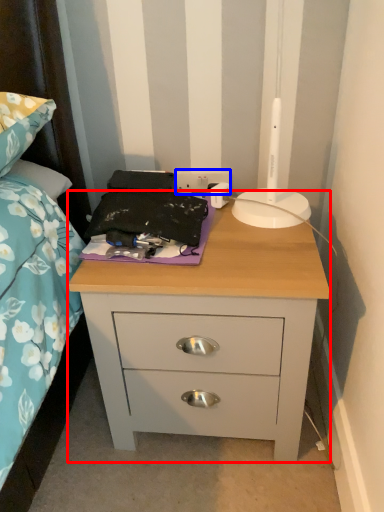
Question: Among these objects, which one is nearest to the camera, nightstand (highlighted by a red box) or electric outlet (highlighted by a blue box)?

Choices:
 (A) nightstand
 (B) electric outlet

Answer: (A)